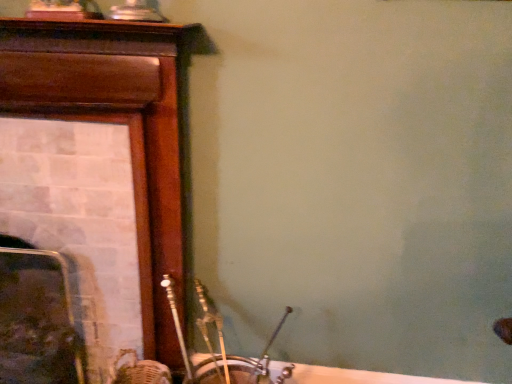
Describe the element at coordinates (118, 123) in the screenshot. The image size is (512, 384). I see `wooden mantle at left` at that location.

Where is `wooden mantle at left`? This screenshot has width=512, height=384. wooden mantle at left is located at coordinates (118, 123).

Measure the distance between wooden mantle at left and camera.

wooden mantle at left is 1.05 meters away from camera.

The image size is (512, 384). Find the location of `wooden mantle at left`. wooden mantle at left is located at coordinates (118, 123).